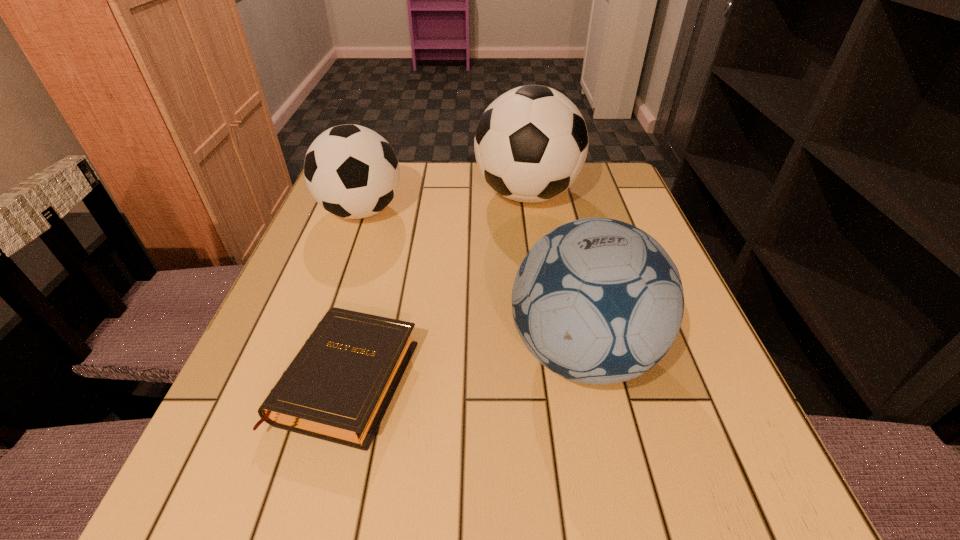
At what (x,y) coordinates should I click in order to perform the action: click on the nearest soccer ball. Please return your answer as a coordinate pair (x, y). The image size is (960, 540). Looking at the image, I should click on (599, 301).

Find the location of a particular element. This screenshot has width=960, height=540. the third tallest object is located at coordinates (351, 171).

I want to click on the shortest soccer ball, so click(351, 171).

Image resolution: width=960 pixels, height=540 pixels. Find the location of `the shortest object`. the shortest object is located at coordinates (338, 387).

Find the location of a particular element. The image size is (960, 540). free space located on the side with brand of the nearest soccer ball is located at coordinates (408, 353).

Find the location of a particular element. The image size is (960, 540). vacant space situated 0.180m on the side with brand of the nearest soccer ball is located at coordinates (402, 353).

Identify the location of vacant position located 0.270m on the side with brand of the nearest soccer ball. This screenshot has height=540, width=960. (349, 353).

Locate an element on the screen. vacant space located 0.140m on the back of the second shortest object is located at coordinates (378, 163).

At what (x,y) coordinates should I click in order to perform the action: click on vacant space situated on the back of the Bible. Please return your answer as a coordinate pair (x, y). Image resolution: width=960 pixels, height=540 pixels. Looking at the image, I should click on (370, 297).

This screenshot has width=960, height=540. What are the coordinates of `soccer ball located at the left edge` in the screenshot? It's located at pos(351,171).